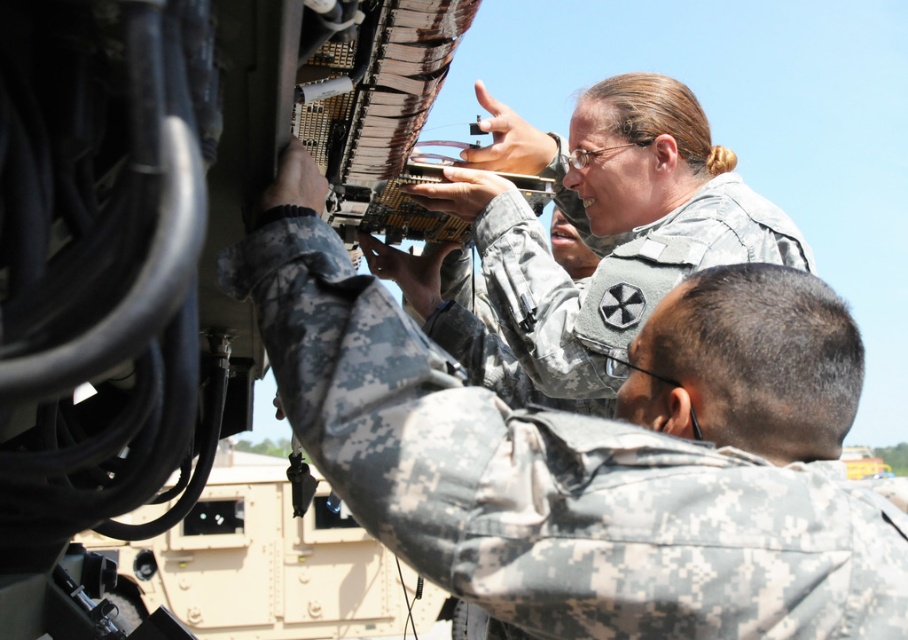
Question: Does camouflage uniform at center appear on the right side of camouflage fabric uniform at upper center?

Choices:
 (A) yes
 (B) no

Answer: (B)

Question: Which point is farther from the camera taking this photo?

Choices:
 (A) (610, 573)
 (B) (622, 352)

Answer: (B)

Question: Can you confirm if camouflage uniform at center is bigger than camouflage fabric uniform at upper center?

Choices:
 (A) yes
 (B) no

Answer: (B)

Question: Is camouflage uniform at center bigger than camouflage fabric uniform at upper center?

Choices:
 (A) yes
 (B) no

Answer: (B)

Question: Among these points, which one is farthest from the camera?

Choices:
 (A) (386, 428)
 (B) (591, 376)

Answer: (B)